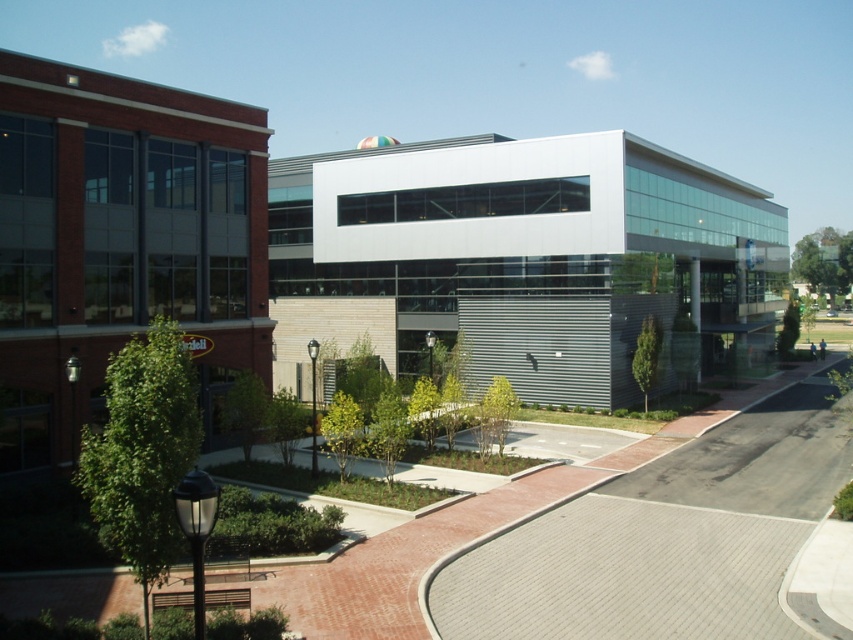
You are a city planner reviewing the urban layout. You need to determine the spatial relationship between the white metallic building at center and the brick building at left. Which building is positioned higher in the image?

The white metallic building at center is located above the brick building at left, so it is positioned higher in the image.

You are an architect evaluating the urban layout. Based on the scene, which object occupies more space in the image between the white metallic building at center and the gray brick pavement at center?

The white metallic building at center has a larger size compared to the gray brick pavement at center, so it occupies more space in the image.

You are standing in front of the two buildings and want to take a photo that includes both points, point [463,237] and point [573,580]. Which point will appear closer to the camera in your photo?

Point [463,237] is further to the camera than point [573,580], so in the photo, point [463,237] will appear closer to the camera than point [573,580].